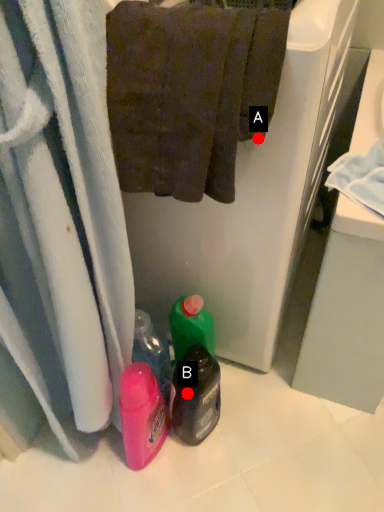
Question: Two points are circled on the image, labeled by A and B beside each circle. Which point is closer to the camera taking this photo?

Choices:
 (A) A is closer
 (B) B is closer

Answer: (A)